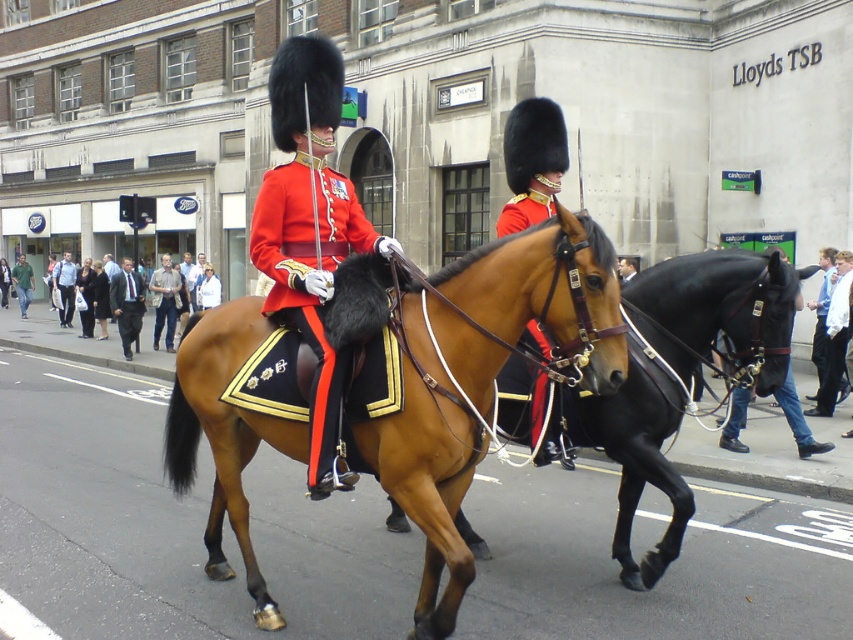
You are a photographer standing on the sidewalk. You want to take a closeup photo of the satin gold helmet at center. The camera you are using has a minimum focusing distance of 2 meters. Can you take the photo without moving closer?

The satin gold helmet at center is 5.39 meters away from the viewer. Since the camera can focus as close as 2 meters, you can take the photo without moving closer because the distance is within the camera s focusing range.

You are a photographer standing at the scene. You want to take a photo of both the satin gold helmet at center and the green cotton shirt at lower left. However, your camera has a maximum focus range of 80 feet. Will you be able to capture both objects clearly in the same photo?

The satin gold helmet at center is 90.28 feet away from the green cotton shirt at lower left. Since the distance between them exceeds the camera maximum focus range of 80 feet, you cannot capture both objects clearly in the same photo.